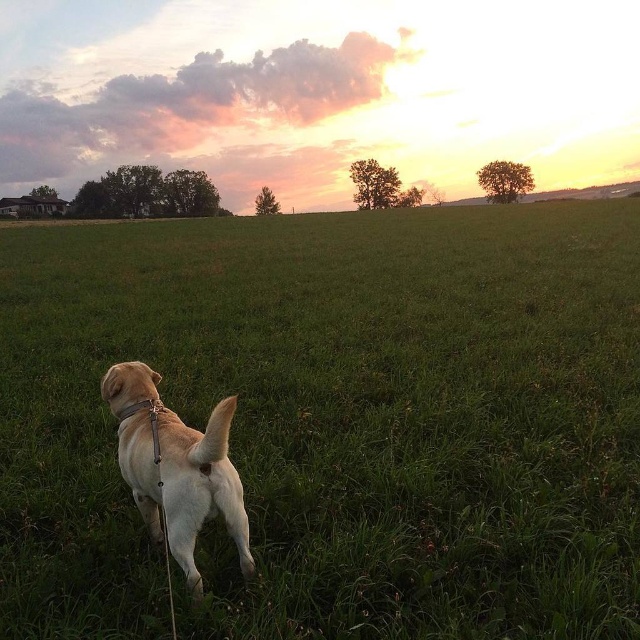
Question: Is green grassy field at center to the right of golden fur dog at center from the viewer's perspective?

Choices:
 (A) yes
 (B) no

Answer: (A)

Question: Among these objects, which one is nearest to the camera?

Choices:
 (A) golden fur dog at center
 (B) green grassy field at center

Answer: (A)

Question: Among these points, which one is nearest to the camera?

Choices:
 (A) (176, 493)
 (B) (266, 525)

Answer: (A)

Question: Is green grassy field at center below golden fur dog at center?

Choices:
 (A) yes
 (B) no

Answer: (B)

Question: Is green grassy field at center to the left of golden fur dog at center from the viewer's perspective?

Choices:
 (A) yes
 (B) no

Answer: (B)

Question: Which point is farther from the camera taking this photo?

Choices:
 (A) (216, 417)
 (B) (211, 273)

Answer: (B)